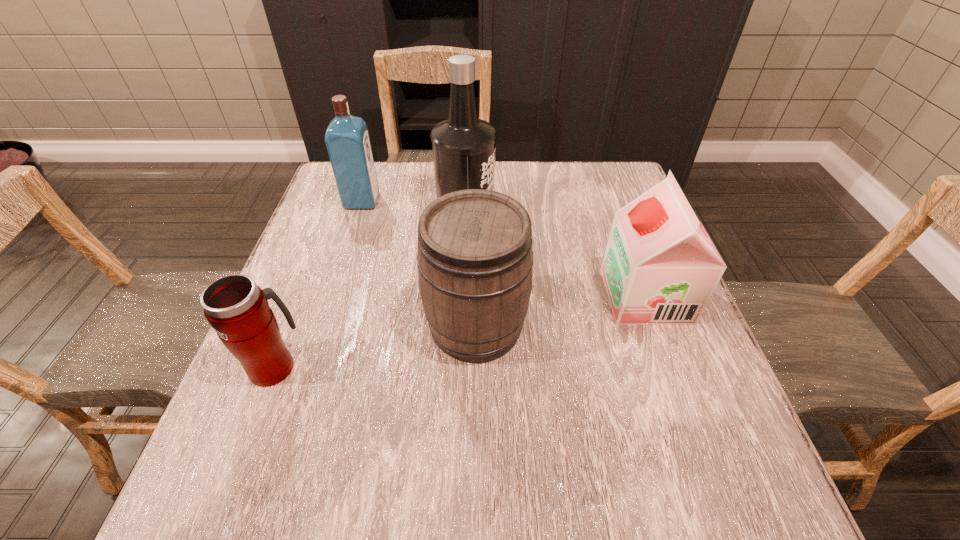
Where is `the tallest object`? The height and width of the screenshot is (540, 960). the tallest object is located at coordinates (464, 147).

What are the coordinates of `the right liquor` in the screenshot? It's located at (464, 147).

At what (x,y) coordinates should I click in order to perform the action: click on the shorter liquor. Please return your answer as a coordinate pair (x, y). The image size is (960, 540). Looking at the image, I should click on (347, 139).

Where is `wine bucket`? The image size is (960, 540). wine bucket is located at coordinates (475, 260).

Locate an element on the screen. The height and width of the screenshot is (540, 960). the rightmost object is located at coordinates (660, 267).

Find the location of a particular element. The height and width of the screenshot is (540, 960). the shortest object is located at coordinates (238, 309).

Locate an element on the screen. The height and width of the screenshot is (540, 960). free space located on the front label of the right liquor is located at coordinates (646, 214).

The height and width of the screenshot is (540, 960). Identify the location of vacant region located 0.310m on the flat label side of the shorter liquor. (492, 201).

At what (x,y) coordinates should I click in order to perform the action: click on free space located 0.310m on the back of the wine bucket. Please return your answer as a coordinate pair (x, y). Image resolution: width=960 pixels, height=540 pixels. Looking at the image, I should click on (477, 204).

Locate an element on the screen. This screenshot has width=960, height=540. free space located 0.110m with the cap open on the rightmost object is located at coordinates (558, 295).